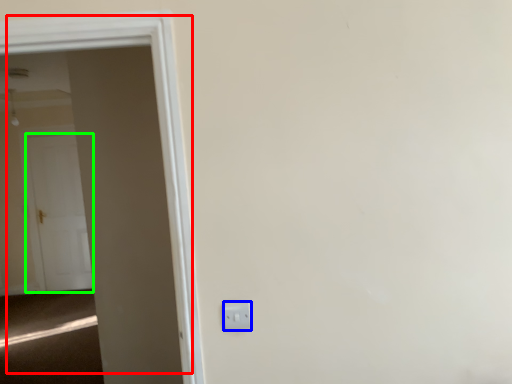
Question: Based on their relative distances, which object is nearer to door (highlighted by a red box)? Choose from electric outlet (highlighted by a blue box) and door (highlighted by a green box).

Choices:
 (A) electric outlet
 (B) door

Answer: (A)